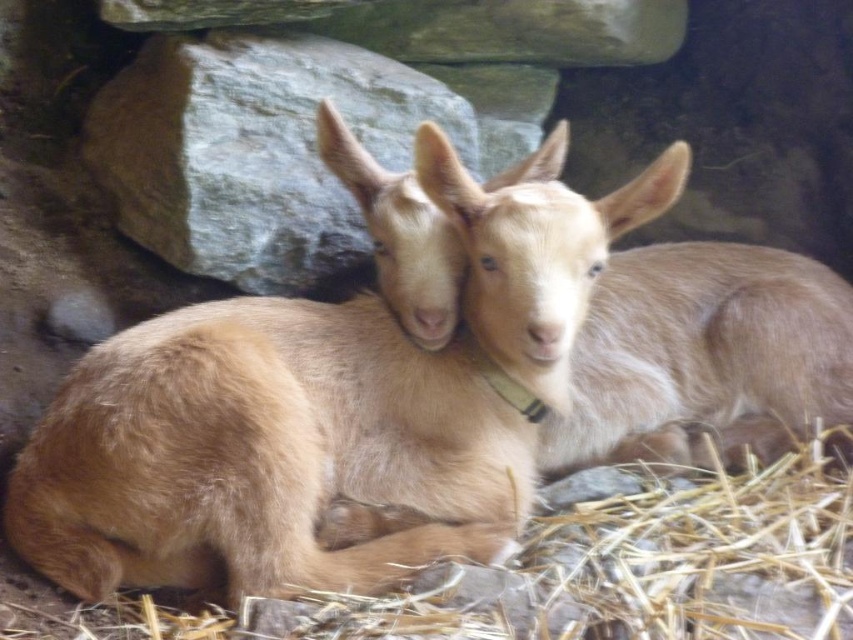
Question: Does light brown fur goat at center have a greater width compared to light brown fur at center?

Choices:
 (A) yes
 (B) no

Answer: (A)

Question: Which object is closer to the camera taking this photo?

Choices:
 (A) light brown fur at center
 (B) brown straw at lower center

Answer: (B)

Question: Which point is farther to the camera?

Choices:
 (A) (57, 552)
 (B) (605, 205)
 (C) (195, 627)

Answer: (B)

Question: Does brown straw at lower center come in front of light brown fur at center?

Choices:
 (A) no
 (B) yes

Answer: (B)

Question: Which of these objects is positioned farthest from the light brown fur at center?

Choices:
 (A) light brown fur goat at center
 (B) brown straw at lower center

Answer: (A)

Question: Can you confirm if light brown fur goat at center is positioned to the right of light brown fur at center?

Choices:
 (A) no
 (B) yes

Answer: (A)